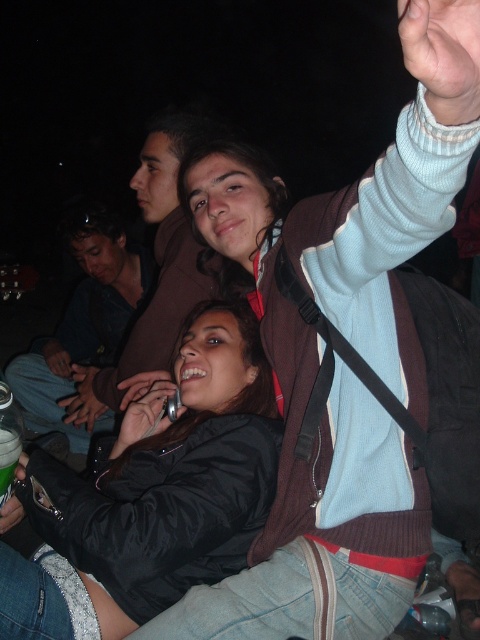
From the picture: Is dark blue shirt at center shorter than green plastic cup at lower left?

In fact, dark blue shirt at center may be taller than green plastic cup at lower left.

The height and width of the screenshot is (640, 480). In order to click on dark blue shirt at center in this screenshot , I will do `click(84, 324)`.

Which of these two, matte black jacket at center or green plastic cup at lower left, stands shorter?

green plastic cup at lower left

Consider the image. Who is lower down, matte black jacket at center or green plastic cup at lower left?

Positioned lower is green plastic cup at lower left.

Who is more distant from viewer, (x=322, y=445) or (x=10, y=460)?

Point (x=322, y=445)

Where is `matte black jacket at center`? The width and height of the screenshot is (480, 640). matte black jacket at center is located at coordinates (342, 356).

Is point (385, 493) positioned before point (243, 438)?

Yes, point (385, 493) is closer to viewer.

Measure the distance between matte black jacket at center and camera.

matte black jacket at center is 18.46 inches from camera.

Which is behind, point (199, 612) or point (200, 561)?

The point (200, 561) is more distant.

The height and width of the screenshot is (640, 480). Find the location of `matte black jacket at center`. matte black jacket at center is located at coordinates (342, 356).